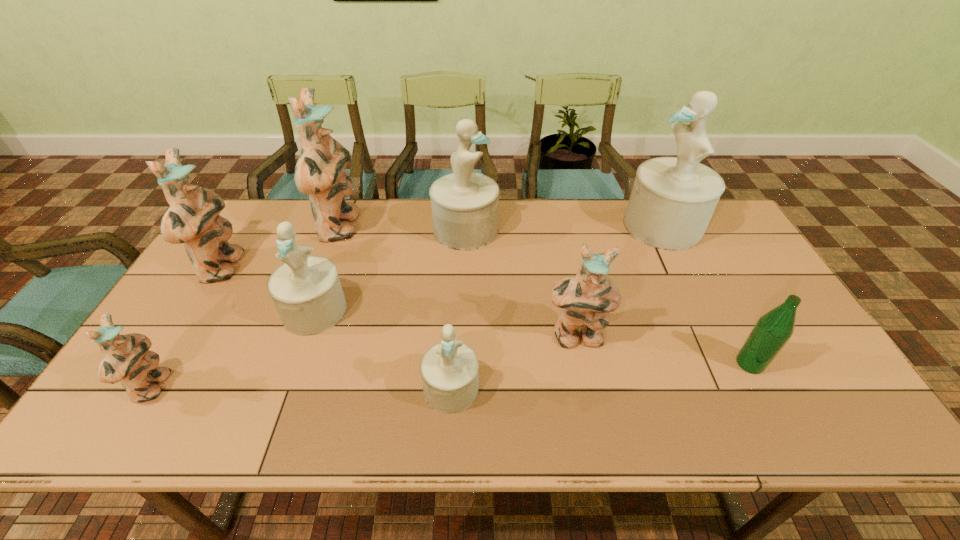
The width and height of the screenshot is (960, 540). What are the coordinates of `the rightmost white figurine` in the screenshot? It's located at (672, 201).

This screenshot has width=960, height=540. I want to click on the rightmost figurine, so click(x=672, y=201).

You are a GUI agent. You are given a task and a screenshot of the screen. Output one action in this format:
    pyautogui.click(x=<x>, y=<y>)
    Task: Click on the biggest pink figurine
    Image resolution: width=960 pixels, height=540 pixels.
    Given the screenshot: What is the action you would take?
    pyautogui.click(x=320, y=172)

At what (x,y) coordinates should I click in order to perform the action: click on the second biggest white figurine. Please return your answer as a coordinate pair (x, y). Looking at the image, I should click on (465, 205).

This screenshot has height=540, width=960. Identify the location of the third smallest pink figurine. (192, 218).

Locate an element on the screen. The width and height of the screenshot is (960, 540). the leftmost white figurine is located at coordinates (306, 290).

The width and height of the screenshot is (960, 540). Find the location of `the second nearest white figurine`. the second nearest white figurine is located at coordinates (306, 290).

Identify the location of the rightmost pink figurine. The height and width of the screenshot is (540, 960). (586, 299).

I want to click on the seventh figurine from left to right, so click(x=586, y=299).

The height and width of the screenshot is (540, 960). I want to click on bottle, so click(x=772, y=331).